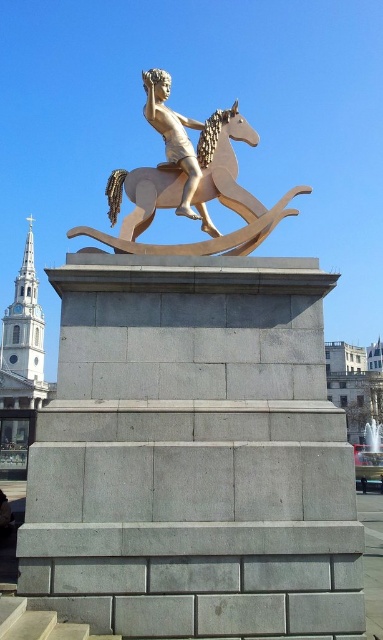
You are an art curator planning to move the gold polished horse at center and the gold polished statue at center into a new exhibition space. The entrance to the exhibition hall has a doorway that is 1.2 meters wide. If you need to move both objects through the doorway one at a time, which object would you move first to ensure they both fit through the doorway?

The gold polished horse at center has a greater width than the gold polished statue at center. Therefore, you should move the gold polished statue at center first, as it is narrower and more likely to fit through the 1.2 meter wide doorway. Once the statue is moved, the horse can be maneuvered through the doorway, provided its width does not exceed the doorway. However, since the horse is wider than the statue, the statue should be moved first to ensure both can pass.

You are an art conservator assessing the placement of the gold polished horse at center and the gold polished statue at center. Which object is smaller in size?

The gold polished horse at center is smaller in size compared to the gold polished statue at center.